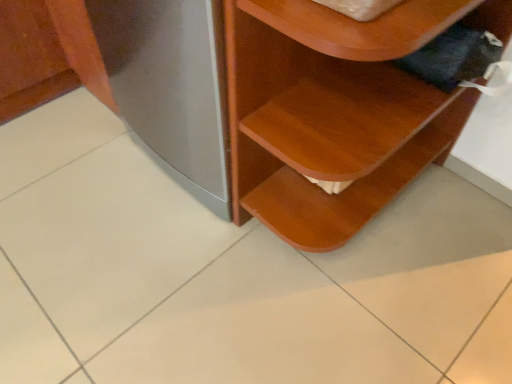
Image resolution: width=512 pixels, height=384 pixels. I want to click on vacant space positioned to the left of wooden shelf at center, so click(158, 254).